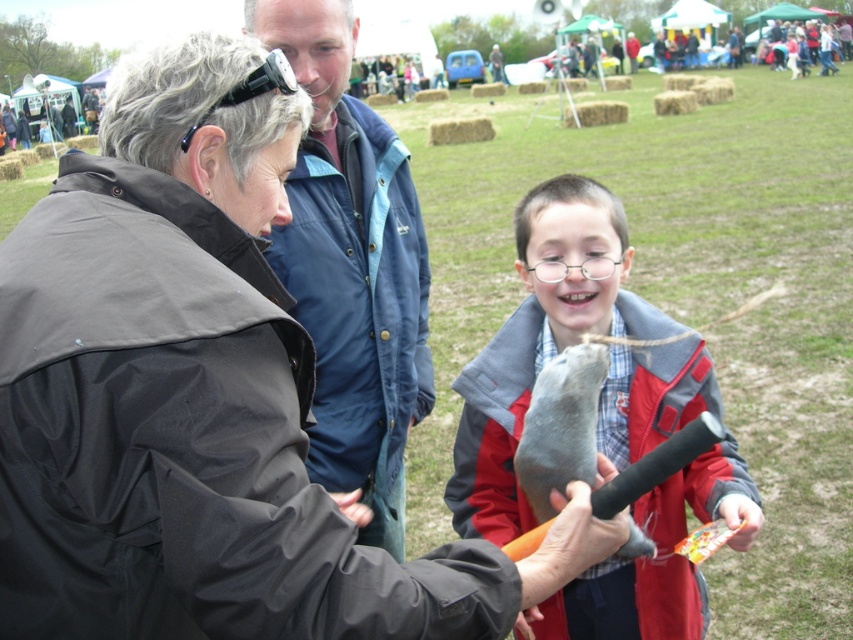
Question: Can you confirm if matte gray plush toy at center is smaller than gray matte fish at center?

Choices:
 (A) no
 (B) yes

Answer: (A)

Question: Does matte gray plush toy at center have a smaller size compared to gray matte fish at center?

Choices:
 (A) no
 (B) yes

Answer: (A)

Question: Does matte black jacket at center appear over gray matte fish at center?

Choices:
 (A) no
 (B) yes

Answer: (B)

Question: Which object is the farthest from the blue fabric jacket at upper center?

Choices:
 (A) matte black jacket at center
 (B) gray matte fish at center

Answer: (B)

Question: Which point is closer to the camera taking this photo?

Choices:
 (A) (680, 625)
 (B) (28, 305)
 (C) (328, 449)
 (D) (579, 360)

Answer: (B)

Question: Which of these objects is positioned closest to the matte gray plush toy at center?

Choices:
 (A) blue fabric jacket at upper center
 (B) gray matte fish at center

Answer: (B)